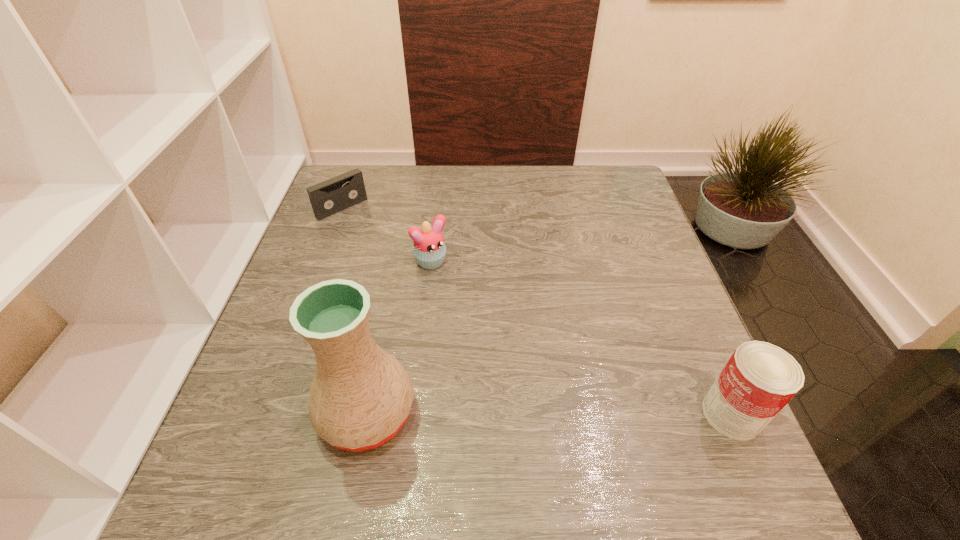
Where is `object that is positioned at the far left corner`? The image size is (960, 540). object that is positioned at the far left corner is located at coordinates (329, 197).

The image size is (960, 540). What are the coordinates of `object located at the near left corner` in the screenshot? It's located at (360, 397).

I want to click on object that is at the near right corner, so click(759, 379).

This screenshot has width=960, height=540. In order to click on vacant area at the far edge in this screenshot , I will do `click(492, 176)`.

The width and height of the screenshot is (960, 540). I want to click on vacant space at the near edge of the desktop, so click(x=413, y=415).

You are a GUI agent. You are given a task and a screenshot of the screen. Output one action in this format:
    pyautogui.click(x=<x>, y=<y>)
    Task: Click on the vacant area at the left edge
    
    Given the screenshot: What is the action you would take?
    pyautogui.click(x=327, y=246)

This screenshot has height=540, width=960. In the image, there is a desktop. In order to click on vacant space at the right edge in this screenshot , I will do `click(631, 239)`.

At what (x,y) coordinates should I click in order to perform the action: click on vacant space at the far right corner of the desktop. Please return your answer as a coordinate pair (x, y). The width and height of the screenshot is (960, 540). Looking at the image, I should click on (615, 176).

This screenshot has height=540, width=960. Identify the location of free space at the near right corner of the desktop. (645, 418).

The height and width of the screenshot is (540, 960). Identify the location of vacant region between the tallest object and the second shortest object. (400, 338).